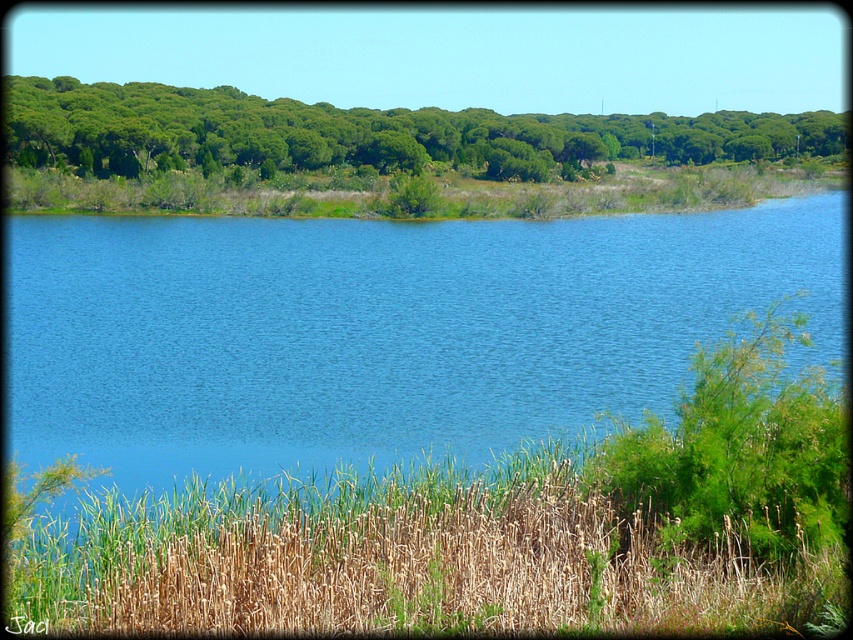
Question: Among these points, which one is farthest from the camera?

Choices:
 (A) (231, 253)
 (B) (416, 154)
 (C) (376, 568)

Answer: (B)

Question: Which object appears closest to the camera in this image?

Choices:
 (A) green leafy trees at upper center
 (B) green dry grass at lower center
 (C) blue water at center

Answer: (B)

Question: Where is blue water at center located in relation to green leafy trees at upper center in the image?

Choices:
 (A) below
 (B) above

Answer: (A)

Question: Does green dry grass at lower center have a lesser width compared to green leafy trees at upper center?

Choices:
 (A) no
 (B) yes

Answer: (B)

Question: Which point is closer to the camera taking this photo?

Choices:
 (A) (613, 570)
 (B) (187, 140)

Answer: (A)

Question: Is blue water at center above green leafy trees at upper center?

Choices:
 (A) yes
 (B) no

Answer: (B)